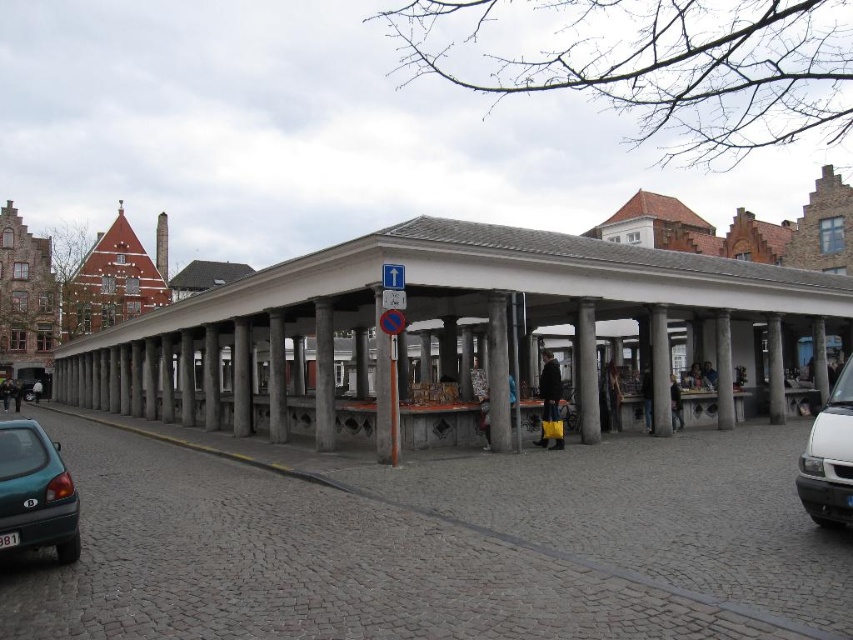
You are a delivery driver with a van that needs to park in the covered market area. The parking space available is exactly 43 meters long. Can your white matte van at lower right fit between the concrete pillars at center without needing to adjust its position?

The distance between the concrete pillars at center and the white matte van at lower right is 43.66 meters. Since the parking space is 43 meters long, the van would not fit as the required space is slightly shorter than the distance available. However, the question mentions parking between the pillars, but the van is already at lower right. Perhaps there is confusion in the setup. Assuming the van needs to park in the 43m space between the pillars, since 43.66m is greater than 43m, the van can fit with some

You are standing at the entrance of the covered market in the European town square. You notice a point marked at coordinates (x=439, y=326). What object is located at this point?

The point at coordinates (x=439, y=326) indicates concrete pillars at center.

You are standing at the entrance of the covered market in the European town square. You notice two points marked in the image. Which point is closer to you, point (x=334, y=444) or point (x=830, y=513)?

Point (x=830, y=513) is closer to you because it is in front of point (x=334, y=444).